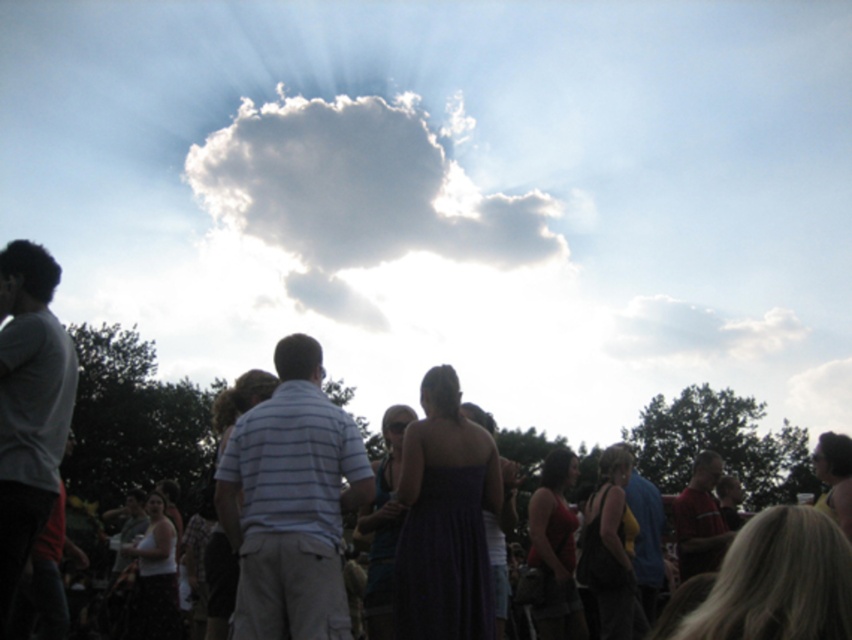
Does silhouette human at center have a lesser height compared to purple satin dress at center?

No.

Is point (643, 413) farther from camera compared to point (413, 465)?

Yes, point (643, 413) is behind point (413, 465).

Which is in front, point (27, 403) or point (440, 445)?

Point (27, 403)

At what (x,y) coordinates should I click in order to perform the action: click on silhouette human at center. Please return your answer as a coordinate pair (x, y). This screenshot has height=640, width=852. Looking at the image, I should click on (104, 416).

Can you confirm if silhouette human at center is thinner than white fluffy cloud at upper center?

Correct, silhouette human at center's width is less than white fluffy cloud at upper center's.

Can you confirm if silhouette human at center is shorter than white fluffy cloud at upper center?

Correct, silhouette human at center is not as tall as white fluffy cloud at upper center.

Is point (148, 456) behind point (303, 122)?

No, (148, 456) is closer to viewer.

Find the location of `silhouette human at center`. silhouette human at center is located at coordinates (104, 416).

Looking at this image, which of these two, white fluffy cloud at upper center or light gray cotton shirt at left, stands shorter?

Standing shorter between the two is light gray cotton shirt at left.

Who is taller, white fluffy cloud at upper center or light gray cotton shirt at left?

With more height is white fluffy cloud at upper center.

Where is `white fluffy cloud at upper center`? Image resolution: width=852 pixels, height=640 pixels. white fluffy cloud at upper center is located at coordinates (360, 188).

This screenshot has height=640, width=852. Identify the location of white fluffy cloud at upper center. (360, 188).